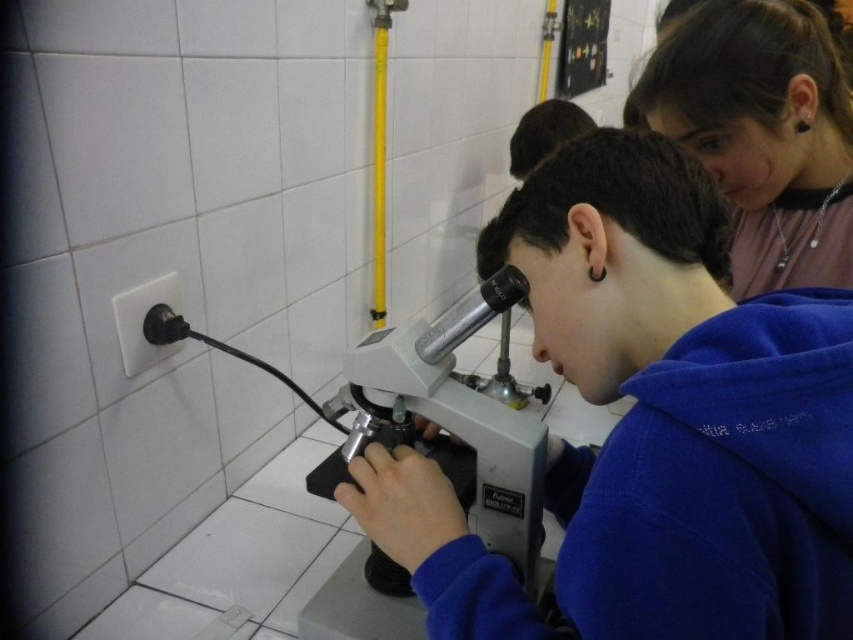
Question: Does matte pink shirt at upper right appear on the left side of metallic silver bulletin board at upper center?

Choices:
 (A) yes
 (B) no

Answer: (A)

Question: Which point is farther to the camera?

Choices:
 (A) silver metallic microscope at center
 (B) blue fleece at center
 (C) matte pink shirt at upper right

Answer: (C)

Question: Which object appears closest to the camera in this image?

Choices:
 (A) silver metallic microscope at center
 (B) metallic silver bulletin board at upper center
 (C) matte pink shirt at upper right
 (D) blue fleece at center

Answer: (D)

Question: Can you confirm if matte pink shirt at upper right is positioned to the right of metallic silver bulletin board at upper center?

Choices:
 (A) no
 (B) yes

Answer: (A)

Question: Which object appears farthest from the camera in this image?

Choices:
 (A) matte pink shirt at upper right
 (B) blue fleece at center
 (C) silver metallic microscope at center

Answer: (A)

Question: Is matte pink shirt at upper right positioned at the back of metallic silver bulletin board at upper center?

Choices:
 (A) yes
 (B) no

Answer: (B)